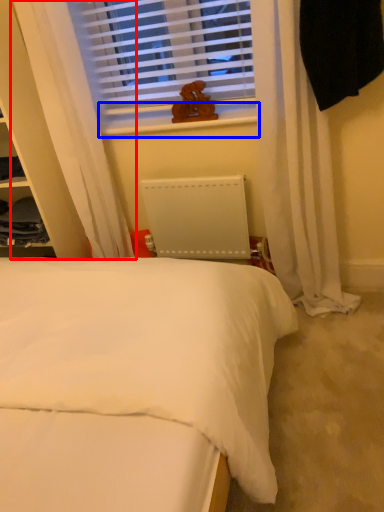
Question: Which of the following is the farthest to the observer, curtain (highlighted by a red box) or window sill (highlighted by a blue box)?

Choices:
 (A) curtain
 (B) window sill

Answer: (B)